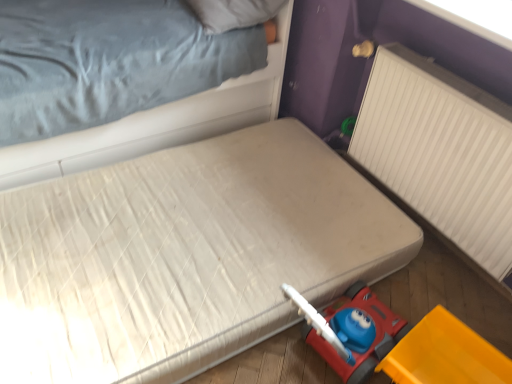
Question: Does white soft pillow at upper center lie in front of white fabric bed at upper left, marked as the 1th bed in a top-to-bottom arrangement?

Choices:
 (A) yes
 (B) no

Answer: (B)

Question: Is white soft pillow at upper center next to white fabric bed at upper left, acting as the second bed starting from the bottom, and touching it?

Choices:
 (A) yes
 (B) no

Answer: (B)

Question: Is white soft pillow at upper center to the right of white fabric bed at upper left, acting as the second bed starting from the bottom, from the viewer's perspective?

Choices:
 (A) no
 (B) yes

Answer: (B)

Question: Can you confirm if white soft pillow at upper center is bigger than white fabric bed at upper left, marked as the 1th bed in a top-to-bottom arrangement?

Choices:
 (A) yes
 (B) no

Answer: (B)

Question: From the image's perspective, is white soft pillow at upper center below white fabric bed at upper left, acting as the second bed starting from the bottom?

Choices:
 (A) no
 (B) yes

Answer: (A)

Question: Considering their positions, is yellow plastic toy car at lower right located in front of or behind white soft pillow at upper center?

Choices:
 (A) behind
 (B) front

Answer: (B)

Question: Based on their positions, is yellow plastic toy car at lower right located to the left or right of white soft pillow at upper center?

Choices:
 (A) left
 (B) right

Answer: (B)

Question: From the image's perspective, relative to white soft pillow at upper center, is yellow plastic toy car at lower right above or below?

Choices:
 (A) below
 (B) above

Answer: (A)

Question: In terms of height, does yellow plastic toy car at lower right look taller or shorter compared to white soft pillow at upper center?

Choices:
 (A) short
 (B) tall

Answer: (B)

Question: Looking at their shapes, would you say yellow plastic toy car at lower right is wider or thinner than white quilted mattress at lower right, marked as the 2th bed in a top-to-bottom arrangement?

Choices:
 (A) thin
 (B) wide

Answer: (A)

Question: From their relative heights in the image, would you say yellow plastic toy car at lower right is taller or shorter than white quilted mattress at lower right, the first bed when ordered from bottom to top?

Choices:
 (A) tall
 (B) short

Answer: (A)

Question: Which is correct: yellow plastic toy car at lower right is inside white quilted mattress at lower right, marked as the 2th bed in a top-to-bottom arrangement, or outside of it?

Choices:
 (A) inside
 (B) outside

Answer: (B)

Question: Is yellow plastic toy car at lower right in front of or behind white quilted mattress at lower right, the first bed when ordered from bottom to top, in the image?

Choices:
 (A) behind
 (B) front

Answer: (B)

Question: From the image's perspective, is white ribbed radiator at right positioned above or below white soft pillow at upper center?

Choices:
 (A) below
 (B) above

Answer: (A)

Question: From a real-world perspective, is white ribbed radiator at right positioned above or below white soft pillow at upper center?

Choices:
 (A) below
 (B) above

Answer: (A)